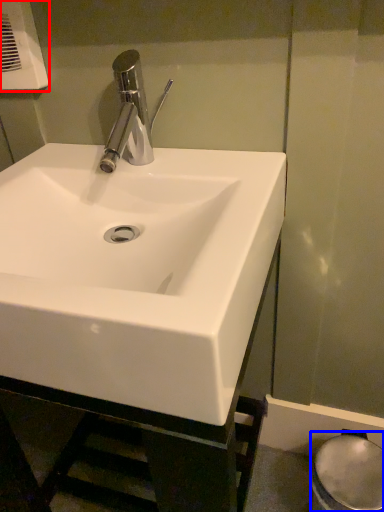
Question: Which object is closer to the camera taking this photo, hand dryer (highlighted by a red box) or bidet (highlighted by a blue box)?

Choices:
 (A) hand dryer
 (B) bidet

Answer: (A)